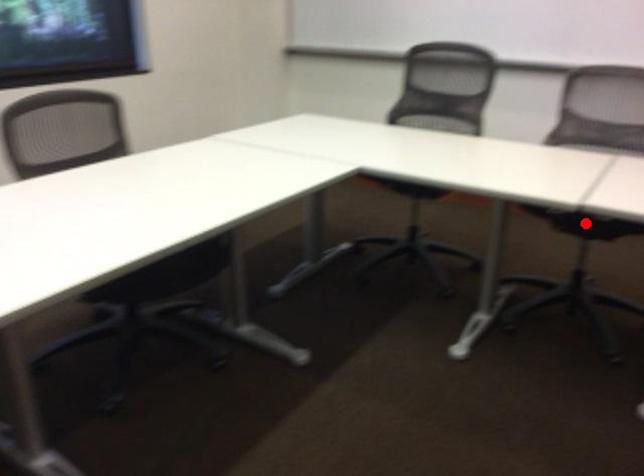
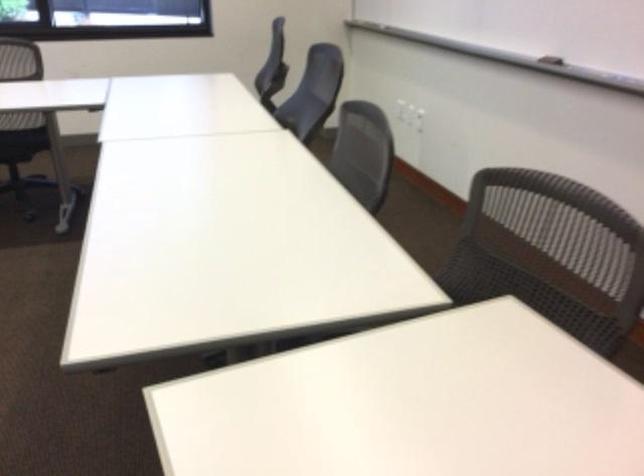
Question: I am providing you with two images of the same scene from different viewpoints. A red point is marked on the first image. At the location where the point appears in image 1, is it still visible in image 2?

Choices:
 (A) Yes
 (B) No

Answer: (B)